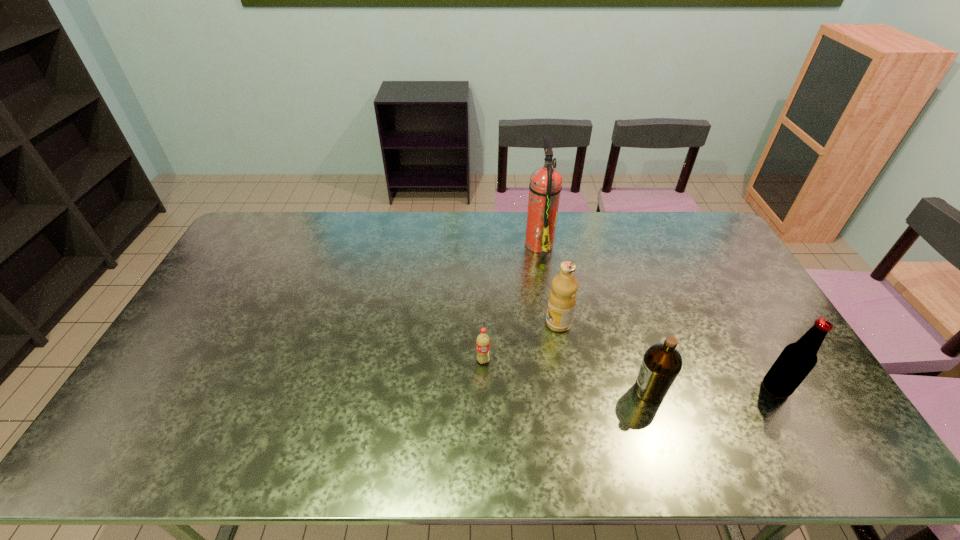
Image resolution: width=960 pixels, height=540 pixels. I want to click on object located at the far edge, so click(x=545, y=186).

The width and height of the screenshot is (960, 540). Identify the location of object that is at the right edge. (796, 361).

The height and width of the screenshot is (540, 960). In order to click on free space at the far edge of the desktop in this screenshot , I will do `click(503, 219)`.

The image size is (960, 540). In the image, there is a desktop. Identify the location of free space at the near edge. (547, 456).

This screenshot has height=540, width=960. Find the location of `vacant space at the left edge of the desktop`. vacant space at the left edge of the desktop is located at coordinates (187, 323).

Locate an element on the screen. The width and height of the screenshot is (960, 540). vacant space at the right edge of the desktop is located at coordinates (815, 393).

Find the location of a particular element. Image resolution: width=960 pixels, height=540 pixels. vacant area at the far right corner of the desktop is located at coordinates (721, 241).

Identify the location of empty space that is in between the tallest object and the beer bottle. (658, 315).

Where is `free spot between the leftmost object and the farthest object`? The height and width of the screenshot is (540, 960). free spot between the leftmost object and the farthest object is located at coordinates (511, 302).

This screenshot has height=540, width=960. Identify the location of vacant area that lies between the leftmost object and the rightmost object. (630, 374).